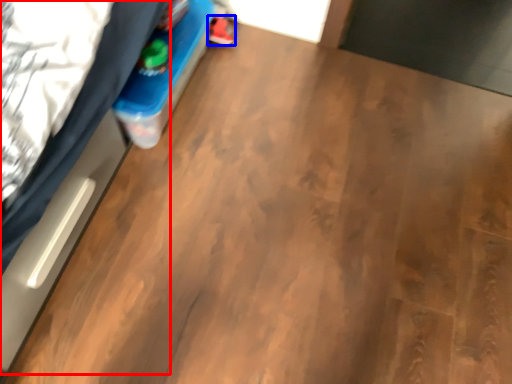
Question: Which object appears farthest to the camera in this image, bed (highlighted by a red box) or footwear (highlighted by a blue box)?

Choices:
 (A) bed
 (B) footwear

Answer: (B)